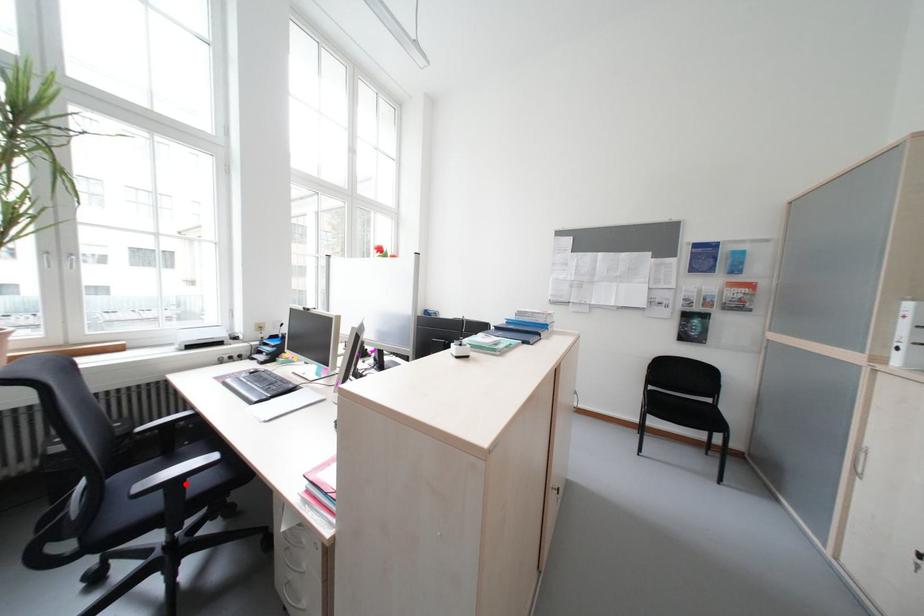
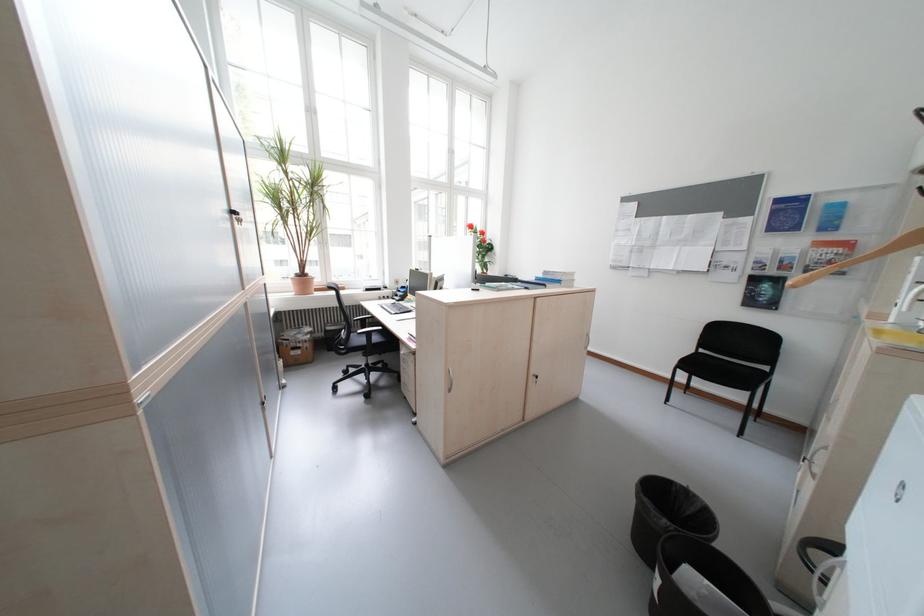
Question: I am providing you with two images of the same scene from different viewpoints. Image1 has a red point marked. In image2, the corresponding 3D location appears at what relative position? Reply with the corresponding letter.

Choices:
 (A) Closer
 (B) Farther

Answer: (B)